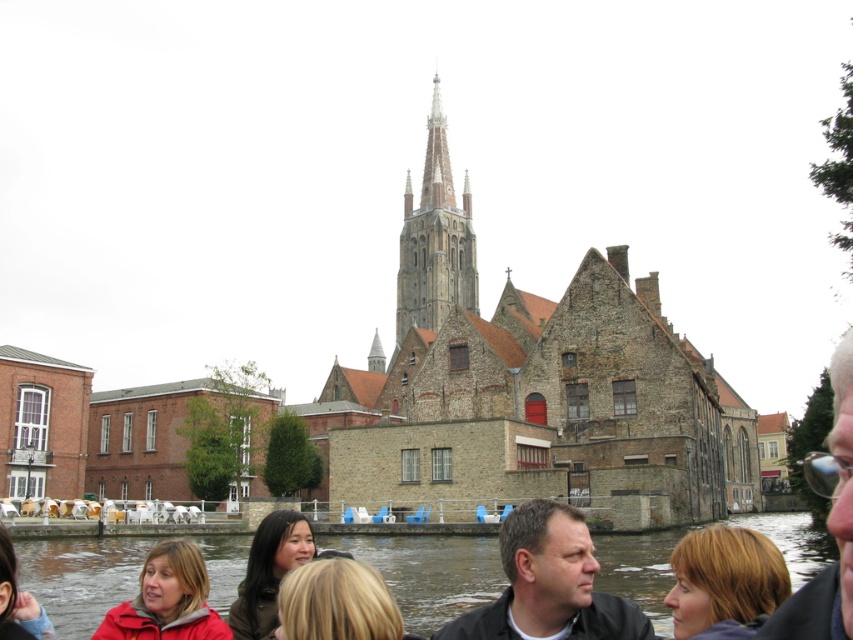
Does point (444, 225) come closer to viewer compared to point (183, 554)?

No, it is not.

Can you confirm if brown stone tower at center is positioned to the right of matte red jacket at lower left?

Correct, you'll find brown stone tower at center to the right of matte red jacket at lower left.

Between point (409, 200) and point (154, 611), which one is positioned in front?

Point (154, 611) is in front.

The height and width of the screenshot is (640, 853). Identify the location of brown stone tower at center. (434, 240).

Who is positioned more to the right, brick church at center or matte red jacket at lower left?

brick church at center

The width and height of the screenshot is (853, 640). Identify the location of brick church at center. (532, 388).

Where is `brick church at center`? This screenshot has width=853, height=640. brick church at center is located at coordinates (532, 388).

Consider the image. Is dark gray jacket at center taller than matte red jacket at lower left?

Yes, dark gray jacket at center is taller than matte red jacket at lower left.

Is point (582, 625) more distant than point (230, 632)?

No.

Describe the element at coordinates (549, 584) in the screenshot. The height and width of the screenshot is (640, 853). I see `dark gray jacket at center` at that location.

In order to click on dark gray jacket at center in this screenshot , I will do `click(549, 584)`.